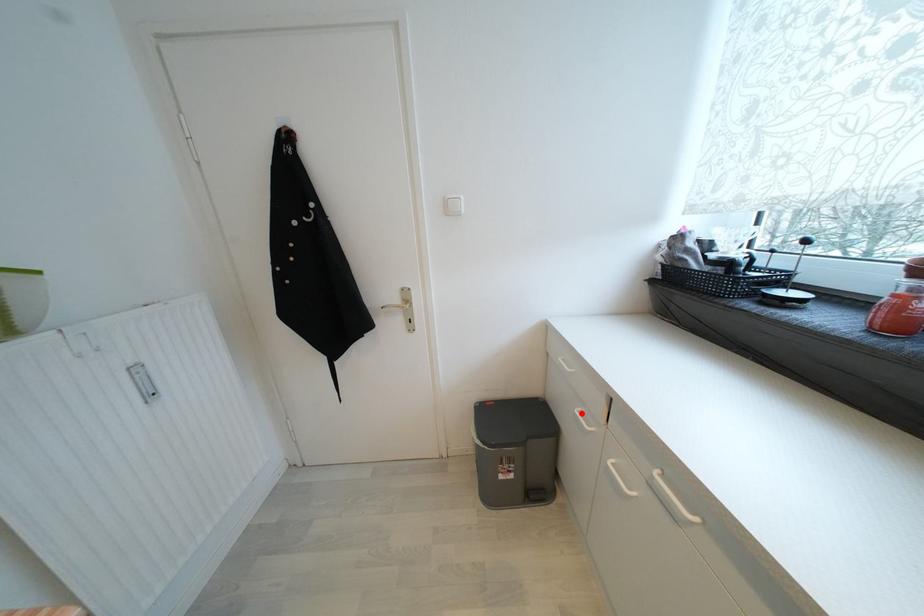
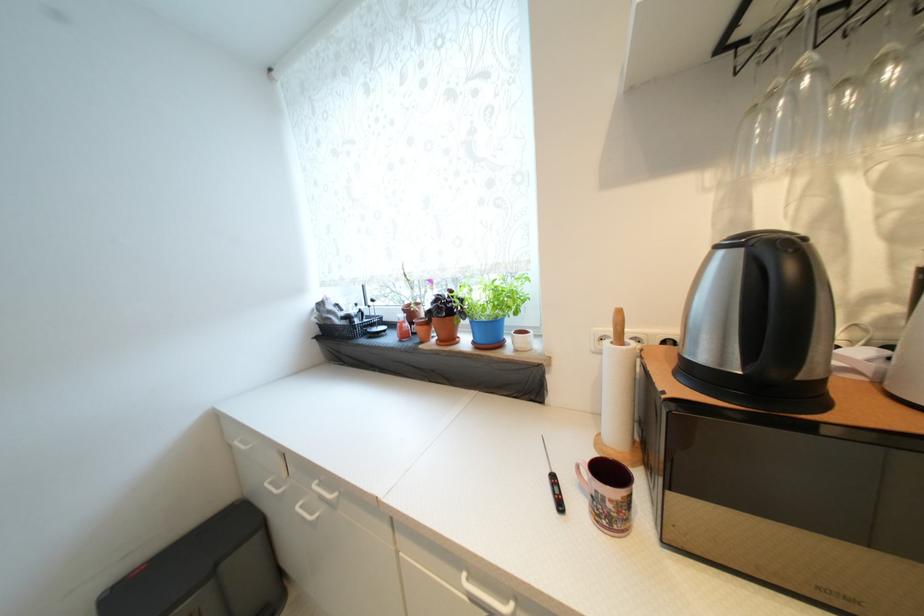
In the second image, find the point that corresponds to the highlighted location in the first image.

(271, 485)